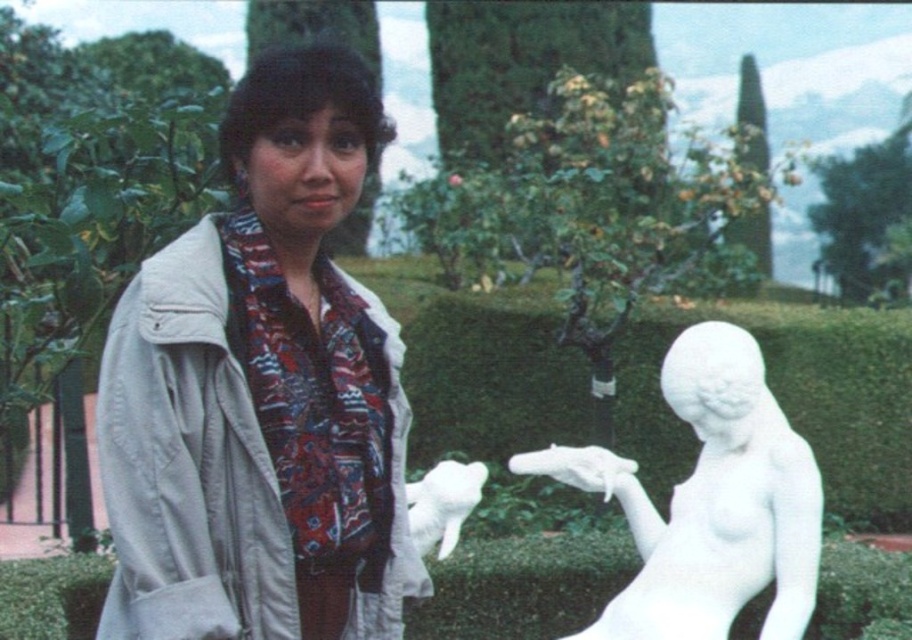
You are planning to place a new bench in the garden so that it can be seen from both the white glossy statue at center and the white marble statue at right. Given their heights, which statue will allow you to see the bench from a greater distance?

The white glossy statue at center is much taller than the white marble statue at right, so the bench will be visible from a greater distance when viewed from the white glossy statue at center due to its increased height providing a better vantage point.

You are an outdoor photographer trying to capture the statue of a reclining figure to the right of the person in the scene. You want to ensure that the white matte jacket at upper left does not appear in your photo. Based on the coordinates provided, what is the best direction to move your camera to avoid including the jacket?

Since the white matte jacket at upper left is located at point (261, 392), moving the camera slightly to the right or downward would help avoid capturing it in the photo.

You are a photographer trying to capture the statue in the center of the image. You notice a point at coordinates (261, 392) that might be obstructing your view. Can you determine if this point is closer to the statue or the person?

The point at coordinates (261, 392) corresponds to the white matte jacket at upper left, which is located near the person. Therefore, it is closer to the person than the statue.